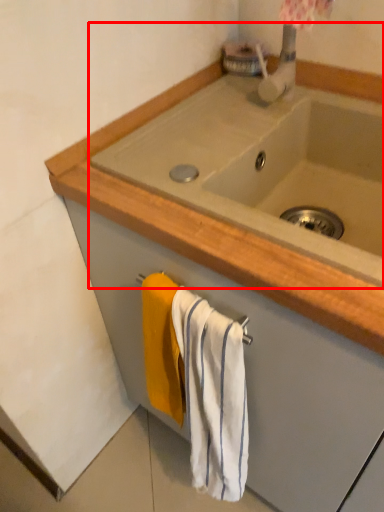
Question: From the image's perspective, considering the relative positions of sink (annotated by the red box) and bath towel in the image provided, where is sink (annotated by the red box) located with respect to the staircase?

Choices:
 (A) above
 (B) below

Answer: (A)